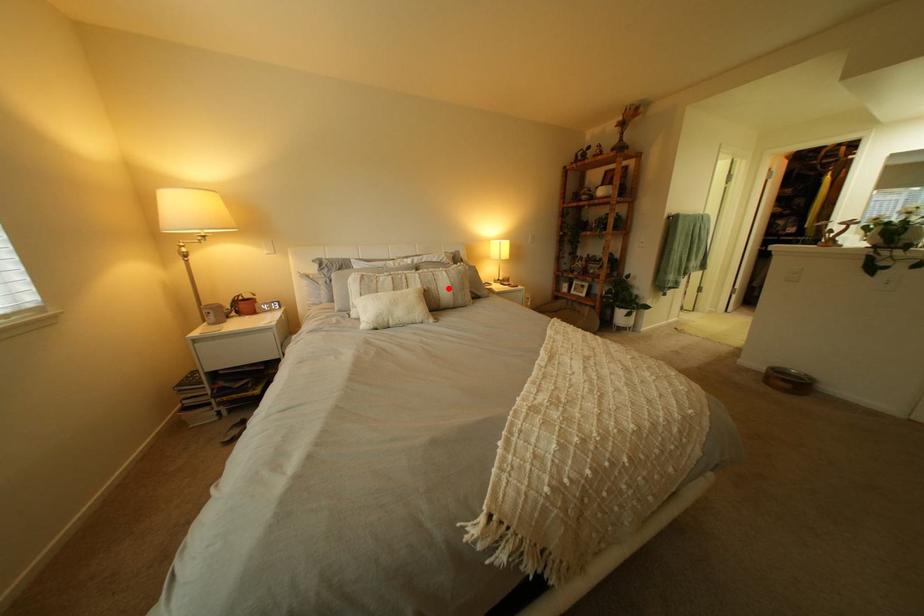
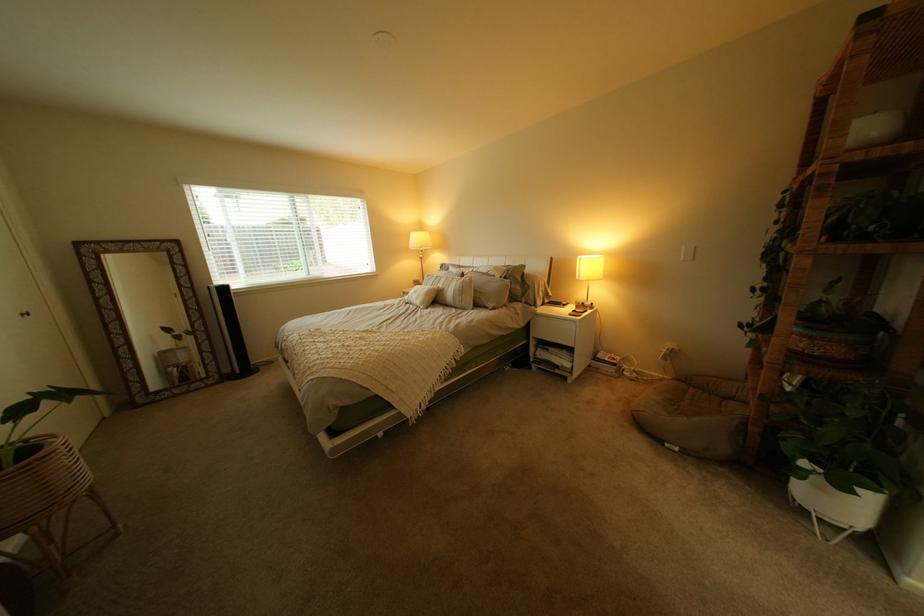
Locate, in the second image, the point that corresponds to the highlighted location in the first image.

(462, 290)